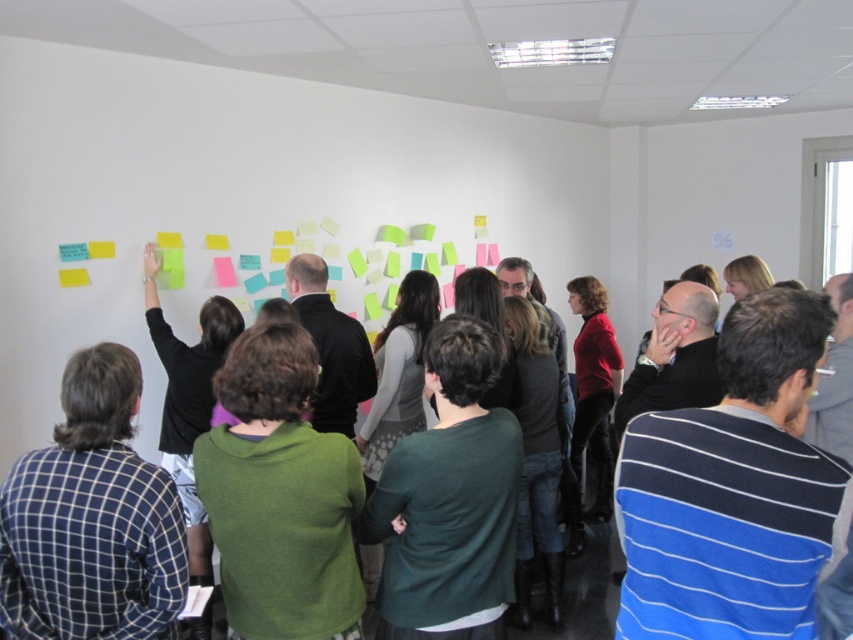
Question: Which of the following is the farthest from the observer?

Choices:
 (A) (73, 589)
 (B) (85, 280)
 (C) (590, 566)

Answer: (C)

Question: Does blue checkered shirt at left appear under green sweater at center?

Choices:
 (A) no
 (B) yes

Answer: (A)

Question: Estimate the real-world distances between objects in this image. Which object is closer to the green sweater at center?

Choices:
 (A) yellow paper at upper left
 (B) blue checkered shirt at left

Answer: (B)

Question: Can you confirm if green sweater at center is positioned below yellow paper at upper left?

Choices:
 (A) no
 (B) yes

Answer: (B)

Question: Which object appears farthest from the camera in this image?

Choices:
 (A) green sweater at center
 (B) blue checkered shirt at left

Answer: (A)

Question: Can you confirm if green sweater at center is positioned to the left of yellow paper at upper left?

Choices:
 (A) no
 (B) yes

Answer: (A)